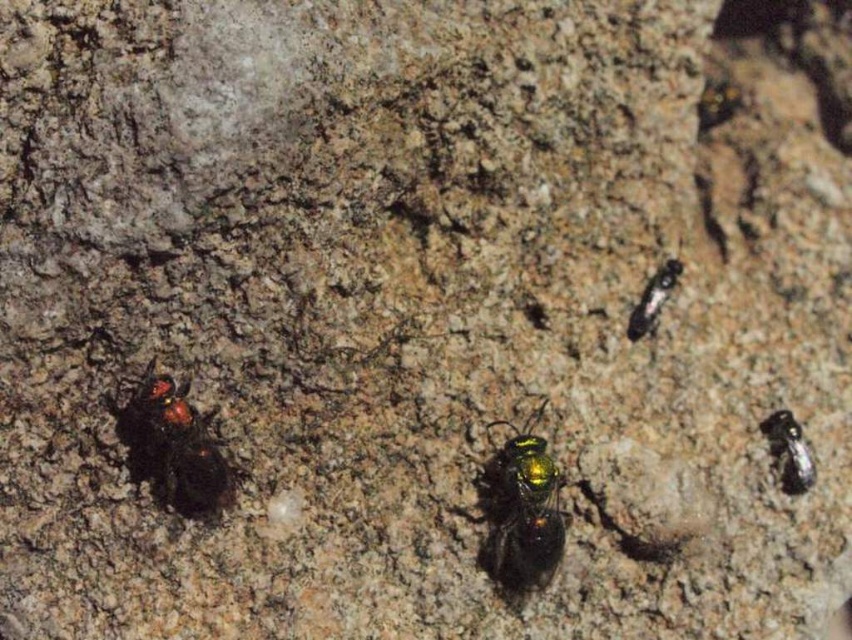
Who is positioned more to the left, metallic green insect at lower right or metallic green insect at center-right?

Positioned to the left is metallic green insect at center-right.

Which is in front, point (797, 435) or point (648, 288)?

Point (797, 435) is in front.

What do you see at coordinates (787, 451) in the screenshot? Image resolution: width=852 pixels, height=640 pixels. I see `metallic green insect at lower right` at bounding box center [787, 451].

This screenshot has height=640, width=852. Identify the location of metallic green insect at lower right. (787, 451).

Looking at this image, can you confirm if metallic green bee at center is positioned below metallic green insect at center-right?

Yes.

Is metallic green bee at center positioned behind metallic green insect at center-right?

No, metallic green bee at center is in front of metallic green insect at center-right.

Where is `metallic green bee at center`? metallic green bee at center is located at coordinates (522, 509).

This screenshot has width=852, height=640. Find the location of `metallic green bee at center`. metallic green bee at center is located at coordinates (522, 509).

Which is behind, point (177, 484) or point (769, 426)?

Positioned behind is point (769, 426).

In order to click on metallic green insect at lower left in this screenshot , I will do `click(174, 444)`.

Find the location of `metallic green insect at lower left`. metallic green insect at lower left is located at coordinates (174, 444).

Locate an element on the screen. The image size is (852, 640). metallic green insect at lower left is located at coordinates (174, 444).